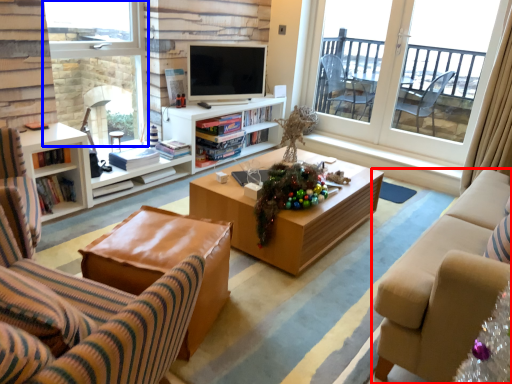
Question: Which of the following is the closest to the observer, studio couch (highlighted by a red box) or window (highlighted by a blue box)?

Choices:
 (A) studio couch
 (B) window

Answer: (A)